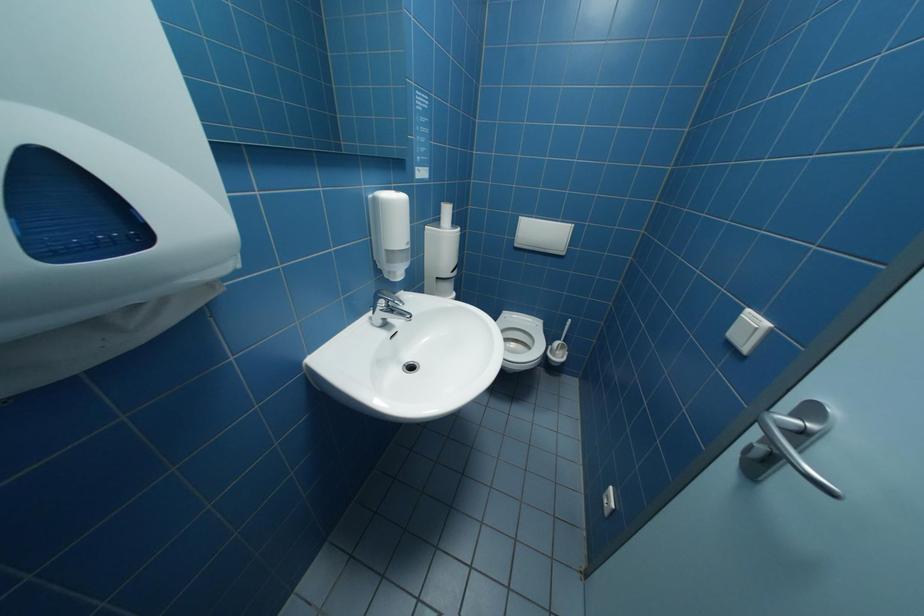
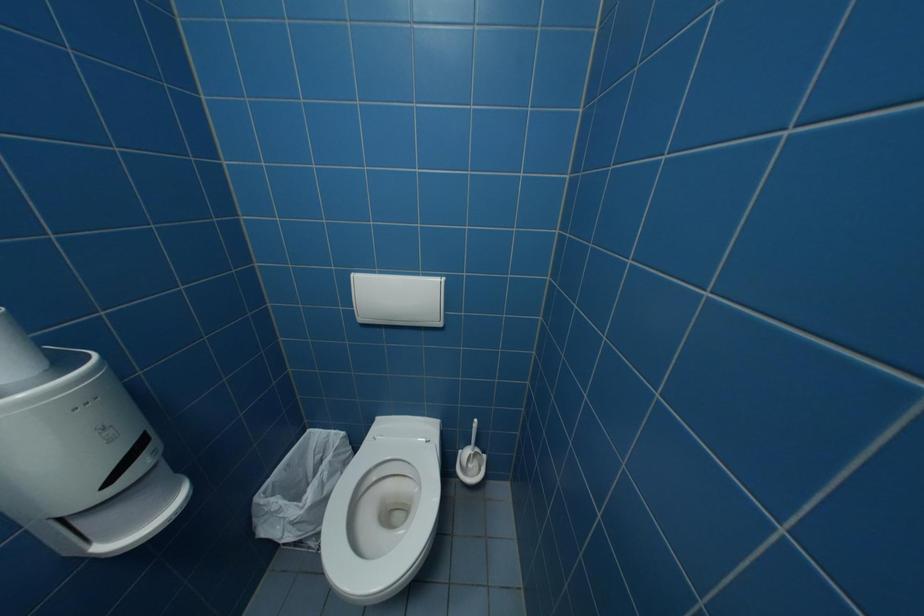
Question: Based on the continuous images, in which direction is the camera rotating? Reply with the corresponding letter.

Choices:
 (A) Left
 (B) Right
 (C) Up
 (D) Down

Answer: (B)